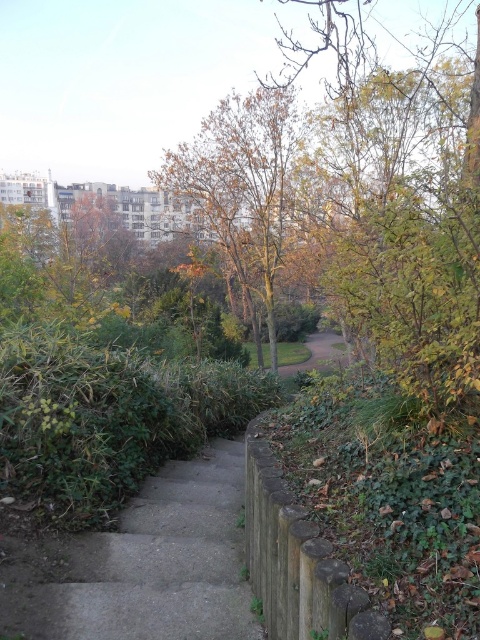
Question: Which point is closer to the camera taking this photo?

Choices:
 (A) (240, 474)
 (B) (253, 218)
 (C) (445, 285)
 (D) (285, 369)

Answer: (C)

Question: Can you confirm if green leafy tree at upper center is positioned to the right of brown leafy tree at center?

Choices:
 (A) no
 (B) yes

Answer: (B)

Question: Does brown leafy tree at center appear over green grass at center?

Choices:
 (A) no
 (B) yes

Answer: (B)

Question: Is brown leafy tree at center wider than green grass at center?

Choices:
 (A) yes
 (B) no

Answer: (A)

Question: Considering the real-world distances, which object is farthest from the brown leafy tree at center?

Choices:
 (A) concrete stairs at center
 (B) green grass at center
 (C) green leafy tree at upper center

Answer: (A)

Question: Which object is positioned farthest from the green leafy tree at upper center?

Choices:
 (A) concrete stairs at center
 (B) green grass at center

Answer: (B)